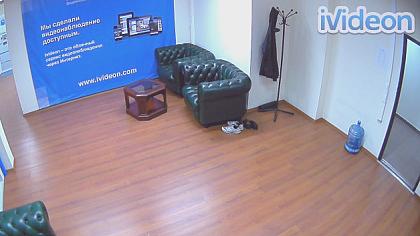
This screenshot has width=420, height=236. Identify the location of table. (156, 107).